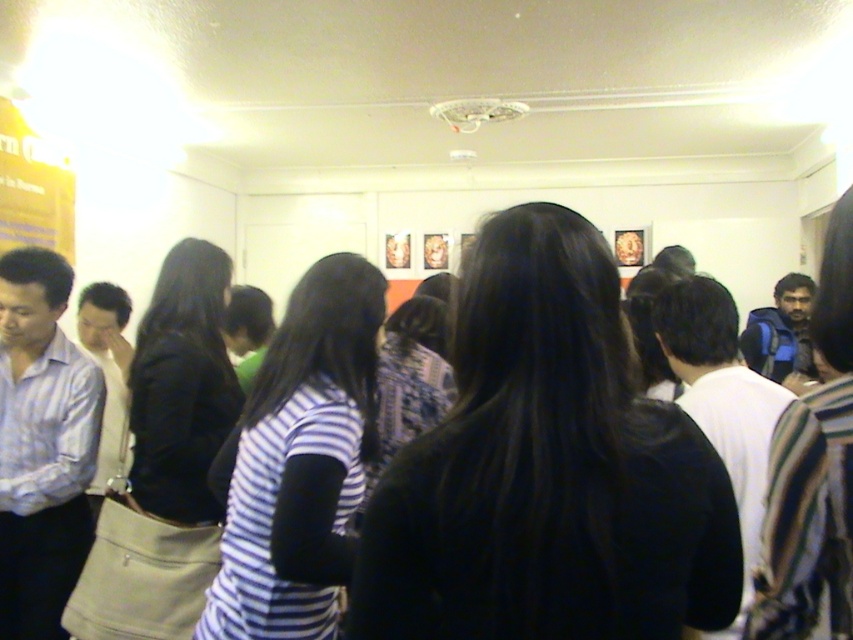
Does black matte hair at center come behind striped fabric shirt at center?

No, black matte hair at center is closer to the viewer.

Does black matte hair at center come in front of striped fabric shirt at center?

That is True.

Describe the element at coordinates (547, 468) in the screenshot. This screenshot has height=640, width=853. I see `black matte hair at center` at that location.

The width and height of the screenshot is (853, 640). In order to click on black matte hair at center in this screenshot , I will do `click(547, 468)`.

Is point (367, 420) behind point (138, 330)?

That is False.

Does striped fabric shirt at center lie in front of matte black jacket at left?

Yes, striped fabric shirt at center is closer to the viewer.

Locate an element on the screen. This screenshot has height=640, width=853. striped fabric shirt at center is located at coordinates (299, 461).

Consider the image. Can you confirm if black matte hair at center is positioned above matte black jacket at left?

Yes.

Can you confirm if black matte hair at center is smaller than matte black jacket at left?

Indeed, black matte hair at center has a smaller size compared to matte black jacket at left.

Does point (636, 531) come behind point (172, 348)?

No, it is not.

Locate an element on the screen. black matte hair at center is located at coordinates (547, 468).